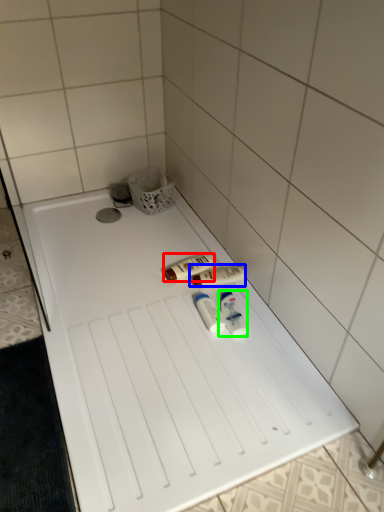
Question: Which is nearer to the toiletry (highlighted by a red box)? toiletry (highlighted by a blue box) or toiletry (highlighted by a green box).

Choices:
 (A) toiletry
 (B) toiletry

Answer: (A)